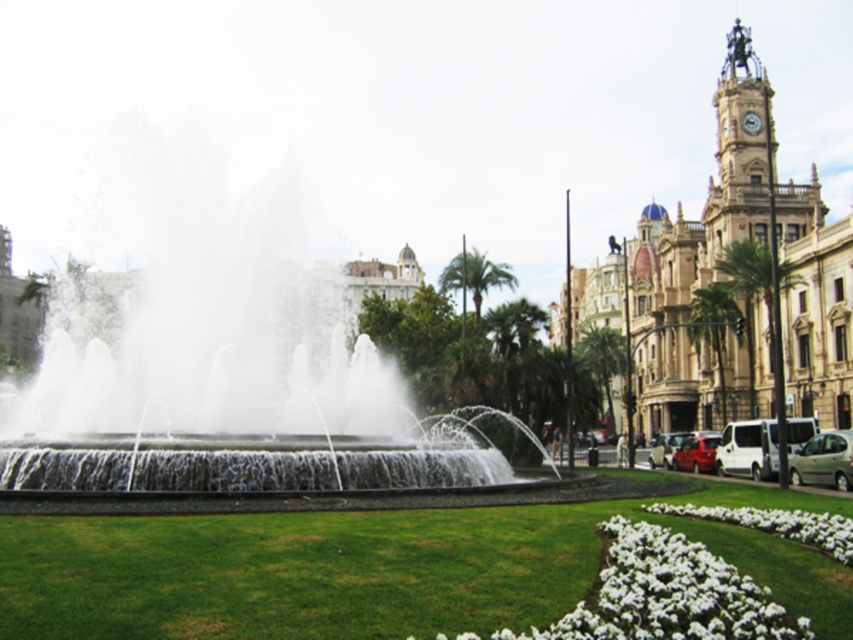
How much distance is there between clear water fountain at center and white matte flowers at lower right?

clear water fountain at center and white matte flowers at lower right are 42.45 meters apart.

Does clear water fountain at center have a larger size compared to white matte flowers at lower right?

Correct, clear water fountain at center is larger in size than white matte flowers at lower right.

Is point (242, 320) closer to viewer compared to point (759, 522)?

No, it is behind (759, 522).

In order to click on clear water fountain at center in this screenshot , I will do `click(231, 385)`.